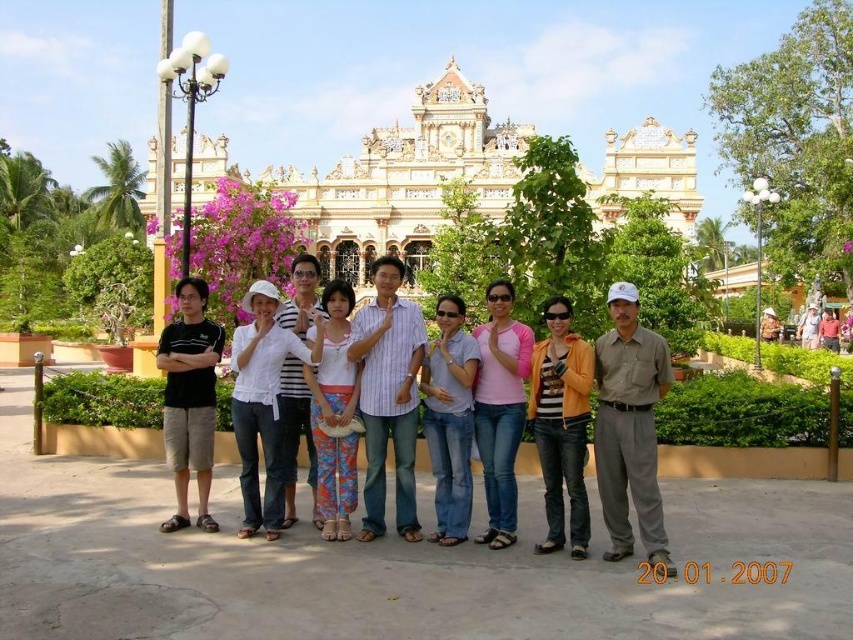
You are a photographer trying to capture a group photo. You notice two people wearing white cotton shirt at center and black cotton shirt at left. Which person should you adjust to the left side to ensure they are aligned properly?

The black cotton shirt at left should be moved to the left side since the white cotton shirt at center is already positioned to its right.

You are a photographer trying to adjust the lighting for a group photo. You notice two people wearing a brown cotton shirt at center and a pink cotton shirt at center. Which person should you position closer to the front to ensure their faces are well lit?

The brown cotton shirt at center is much taller than the pink cotton shirt at center, so positioning the person in the pink cotton shirt at center closer to the front will ensure their face is well lit.

Looking at the group of people in front of the building, where is the brown cotton shirt at center compared to the pink cotton shirt at center?

The brown cotton shirt at center is to the right of the pink cotton shirt at center.